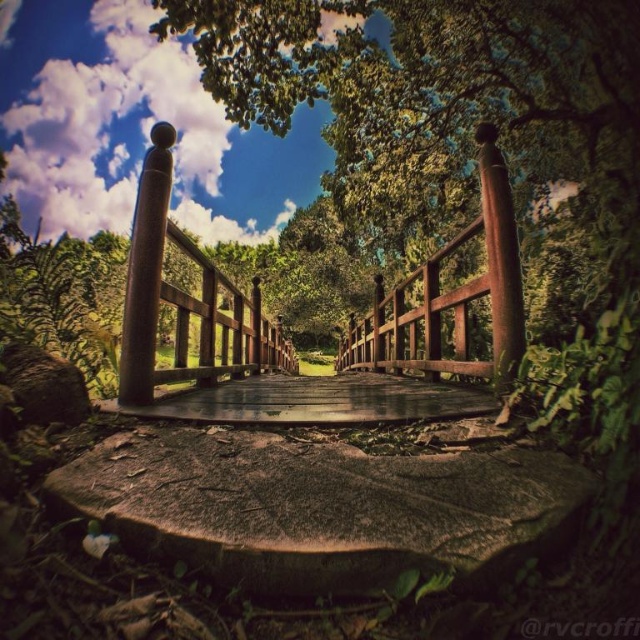
Question: Is the position of brown rough stone at lower center less distant than that of brown polished wood post at center?

Choices:
 (A) yes
 (B) no

Answer: (A)

Question: Does brown rough stone at lower center lie in front of smooth reddish-brown wooden post at center-right?

Choices:
 (A) no
 (B) yes

Answer: (B)

Question: Which point is farther from the camera taking this photo?

Choices:
 (A) (131, 264)
 (B) (298, 579)
 (C) (307, 408)
 (D) (424, 268)

Answer: (D)

Question: Which of these objects is positioned farthest from the rustic wood bridge at center?

Choices:
 (A) wooden bridge at center
 (B) brown polished wood post at center

Answer: (B)

Question: Can you confirm if brown rough stone at lower center is positioned to the left of brown polished wood post at center?

Choices:
 (A) yes
 (B) no

Answer: (B)

Question: Among these points, which one is farthest from the camera?

Choices:
 (A) (136, 234)
 (B) (356, 387)

Answer: (B)